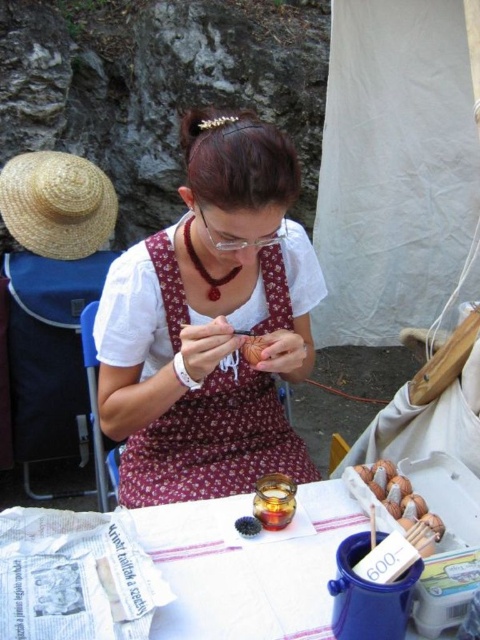
Can you confirm if matte brown apron at center is taller than brown wooden beads at lower right?

Correct, matte brown apron at center is much taller as brown wooden beads at lower right.

Does matte brown apron at center have a larger size compared to brown wooden beads at lower right?

Yes, matte brown apron at center is bigger than brown wooden beads at lower right.

Locate an element on the screen. The width and height of the screenshot is (480, 640). matte brown apron at center is located at coordinates (210, 323).

Which of these two, straw hat at left or brown wooden beads at lower right, stands taller?

straw hat at left

Is point (106, 209) positioned after point (424, 515)?

Yes, it is behind point (424, 515).

Where is `straw hat at left`? straw hat at left is located at coordinates (57, 204).

Is point (233, 568) less distant than point (254, 362)?

Yes, it is.

Does white paper at lower center appear under brown textured bread at center?

Correct, white paper at lower center is located below brown textured bread at center.

In order to click on white paper at lower center in this screenshot , I will do `click(245, 570)`.

Locate an element on the screen. The image size is (480, 640). white paper at lower center is located at coordinates (245, 570).